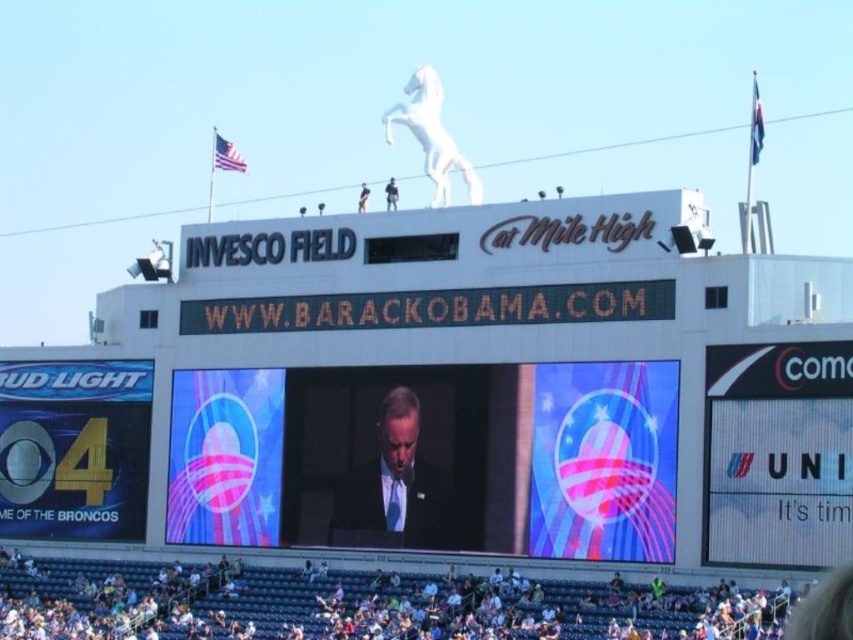
You are a stagehand at Invesco Field at Mile High and need to place a 3.5 meter wide banner between the white fabric crowd at lower center and the dark suit at center. Is there enough space to fit the banner without overlapping either object?

The distance between the white fabric crowd at lower center and the dark suit at center is 5.21 meters. Since the banner is 3.5 meters wide, there is enough space to place it between them without overlapping either object.

You are a photographer at Invesco Field at Mile High during a Barack Obama event. You need to capture a photo where both the white fabric crowd at lower center and the dark suit at center are visible. Based on their heights, which object should be placed closer to the foreground to ensure both are in focus?

The white fabric crowd at lower center is not as tall as the dark suit at center. To ensure both are in focus, position the camera closer to the foreground of the white fabric crowd at lower center since it is shorter, allowing the dark suit at center to be captured in the background without depth of field issues.

You are standing at the entrance of Invesco Field at Mile High and see two points in the stadium. Which point is closer to you, point (474, 636) or point (412, 449)?

Point (474, 636) is closer to you than point (412, 449).